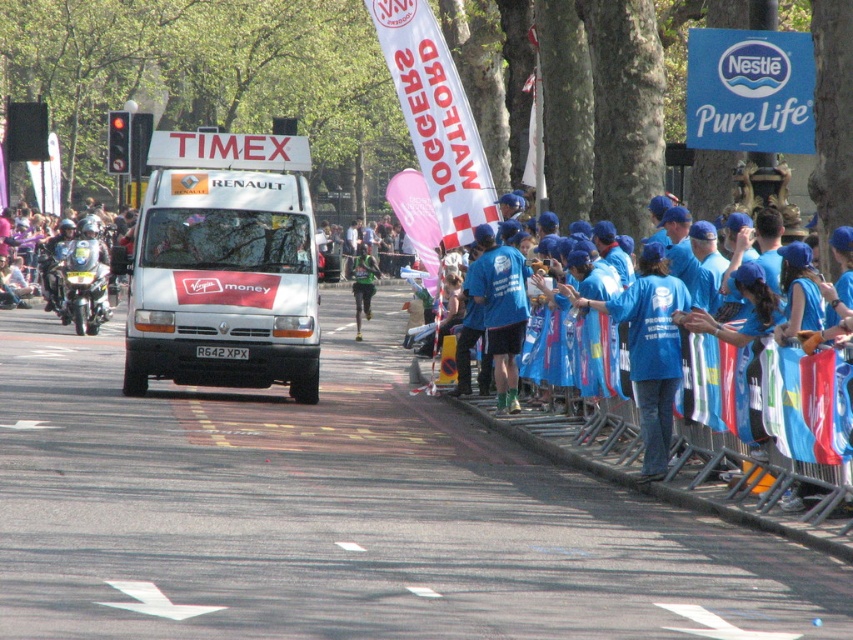
Question: Does blue fabric shirt at center appear on the left side of green fabric runner at center?

Choices:
 (A) yes
 (B) no

Answer: (B)

Question: Which point appears closest to the camera in this image?

Choices:
 (A) (366, 252)
 (B) (148, 209)

Answer: (B)

Question: Can you confirm if white matte van at center is bigger than green fabric runner at center?

Choices:
 (A) no
 (B) yes

Answer: (A)

Question: In this image, where is white matte van at center located relative to green fabric runner at center?

Choices:
 (A) left
 (B) right

Answer: (A)

Question: Among these points, which one is farthest from the camera?

Choices:
 (A) (370, 294)
 (B) (641, 358)

Answer: (A)

Question: Which object is the closest to the white matte van at center?

Choices:
 (A) green fabric runner at center
 (B) blue fabric shirt at center

Answer: (B)